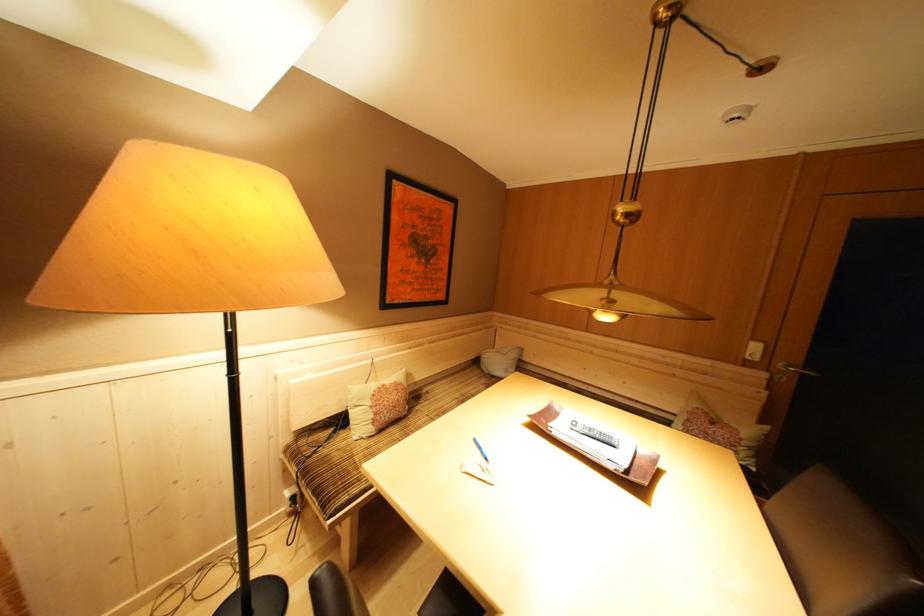
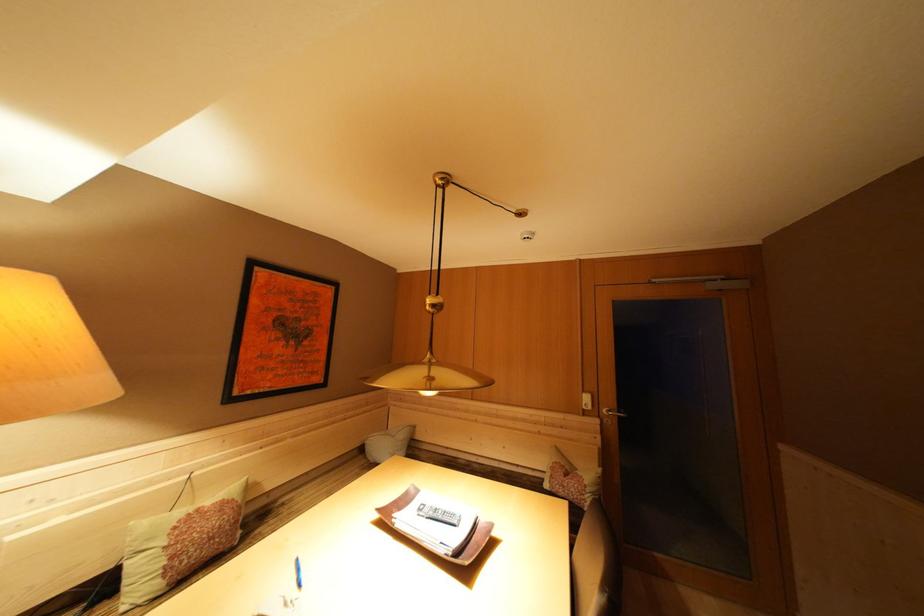
Locate, in the second image, the point that corresponds to [519,361] in the first image.

(408, 440)